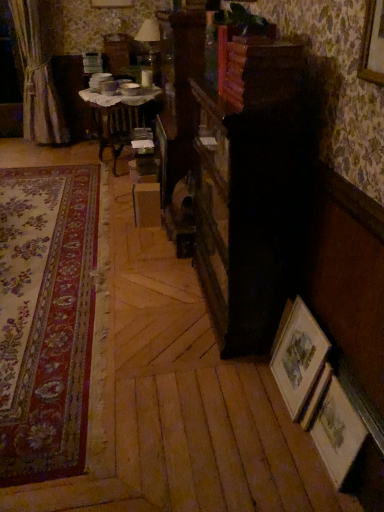
At what (x,y) coordinates should I click in order to perform the action: click on vacant region to the left of silky beige curtain at left. Please return your answer as a coordinate pair (x, y). Image resolution: width=384 pixels, height=512 pixels. Looking at the image, I should click on (11, 145).